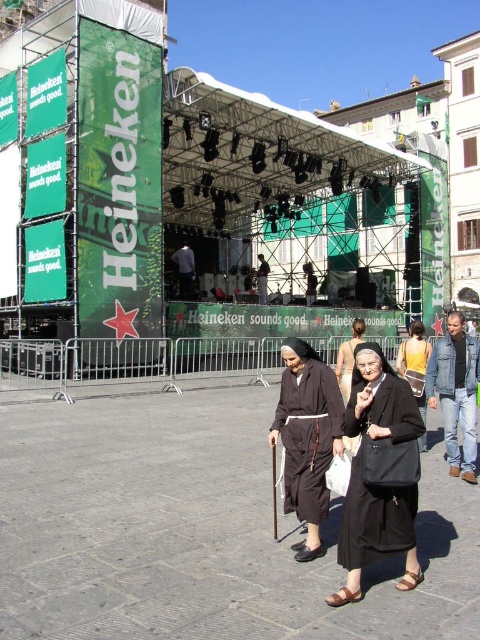
Question: Which object is positioned closest to the black matte nun at center?

Choices:
 (A) dark brown fabric robe at center
 (B) dark blue jeans at center
 (C) brown fabric nun at center

Answer: (C)

Question: Which object is the closest to the black fabric dress at center?

Choices:
 (A) dark blue jeans at center
 (B) denim jacket at lower right

Answer: (B)

Question: Does black matte nun at center appear over dark blue jeans at center?

Choices:
 (A) yes
 (B) no

Answer: (B)

Question: Is black fabric nun at center closer to the viewer compared to dark blue jeans at center?

Choices:
 (A) no
 (B) yes

Answer: (B)

Question: Which of these objects is positioned closest to the dark blue jeans at center?

Choices:
 (A) dark brown fabric robe at center
 (B) brown fabric nun at center
 (C) denim jacket at lower right

Answer: (A)

Question: Does black matte nun at center have a lesser width compared to dark blue jeans at center?

Choices:
 (A) yes
 (B) no

Answer: (A)